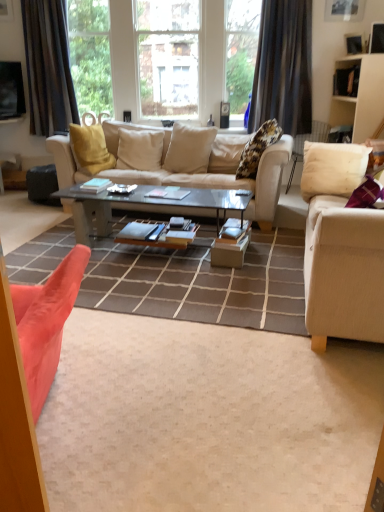
Question: From the image's perspective, would you say beige fabric couch at center, placed as the second studio couch when sorted from right to left, is shown under dark gray textured curtain at left, acting as the 1th curtain starting from the left?

Choices:
 (A) no
 (B) yes

Answer: (B)

Question: Would you say beige fabric couch at center, placed as the second studio couch when sorted from right to left, is a long distance from dark gray textured curtain at left, the 2th curtain when ordered from right to left?

Choices:
 (A) no
 (B) yes

Answer: (B)

Question: Can you confirm if beige fabric couch at center, the 1th studio couch from the left, is wider than dark gray textured curtain at left, the 2th curtain when ordered from right to left?

Choices:
 (A) yes
 (B) no

Answer: (A)

Question: Is beige fabric couch at center, the 1th studio couch from the left, to the left of dark gray textured curtain at left, the 2th curtain when ordered from right to left, from the viewer's perspective?

Choices:
 (A) no
 (B) yes

Answer: (A)

Question: Considering the relative sizes of beige fabric couch at center, the 1th studio couch from the left, and dark gray textured curtain at left, the 2th curtain when ordered from right to left, in the image provided, is beige fabric couch at center, the 1th studio couch from the left, thinner than dark gray textured curtain at left, the 2th curtain when ordered from right to left,?

Choices:
 (A) yes
 (B) no

Answer: (B)

Question: Considering their positions, is fluffy beige pillow at upper center, the third pillow viewed from the left, located in front of or behind white matte cabinet at upper right?

Choices:
 (A) front
 (B) behind

Answer: (A)

Question: In terms of height, does fluffy beige pillow at upper center, placed as the 2th pillow when sorted from right to left, look taller or shorter compared to white matte cabinet at upper right?

Choices:
 (A) tall
 (B) short

Answer: (B)

Question: Is point (243, 159) positioned closer to the camera than point (372, 114)?

Choices:
 (A) farther
 (B) closer

Answer: (B)

Question: From the image's perspective, is fluffy beige pillow at upper center, the third pillow viewed from the left, positioned above or below white matte cabinet at upper right?

Choices:
 (A) above
 (B) below

Answer: (B)

Question: Considering the positions of clear glass window at center and fluffy beige pillow at upper center, placed as the 2th pillow when sorted from right to left, in the image, is clear glass window at center taller or shorter than fluffy beige pillow at upper center, placed as the 2th pillow when sorted from right to left,?

Choices:
 (A) short
 (B) tall

Answer: (B)

Question: From a real-world perspective, is clear glass window at center above or below fluffy beige pillow at upper center, placed as the 2th pillow when sorted from right to left?

Choices:
 (A) above
 (B) below

Answer: (A)

Question: Is clear glass window at center wider or thinner than fluffy beige pillow at upper center, placed as the 2th pillow when sorted from right to left?

Choices:
 (A) thin
 (B) wide

Answer: (B)

Question: Considering the relative positions of clear glass window at center and fluffy beige pillow at upper center, the third pillow viewed from the left, in the image provided, is clear glass window at center to the left or to the right of fluffy beige pillow at upper center, the third pillow viewed from the left,?

Choices:
 (A) right
 (B) left

Answer: (B)

Question: From the image's perspective, is beige fabric pillow at center, which is the third pillow from right to left, above or below velvet orange armchair at center?

Choices:
 (A) above
 (B) below

Answer: (B)

Question: Considering the positions of beige fabric pillow at center, which is the third pillow from right to left, and velvet orange armchair at center in the image, is beige fabric pillow at center, which is the third pillow from right to left, taller or shorter than velvet orange armchair at center?

Choices:
 (A) short
 (B) tall

Answer: (B)